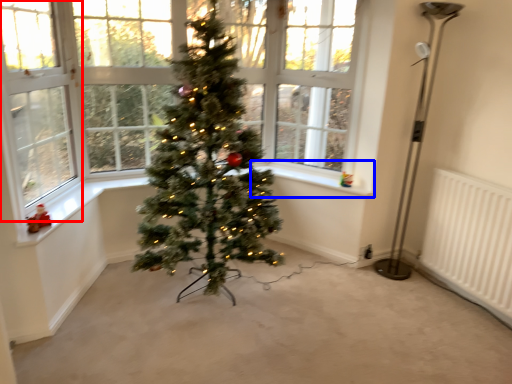
Question: Among these objects, which one is nearest to the camera, window screen (highlighted by a red box) or window sill (highlighted by a blue box)?

Choices:
 (A) window screen
 (B) window sill

Answer: (A)